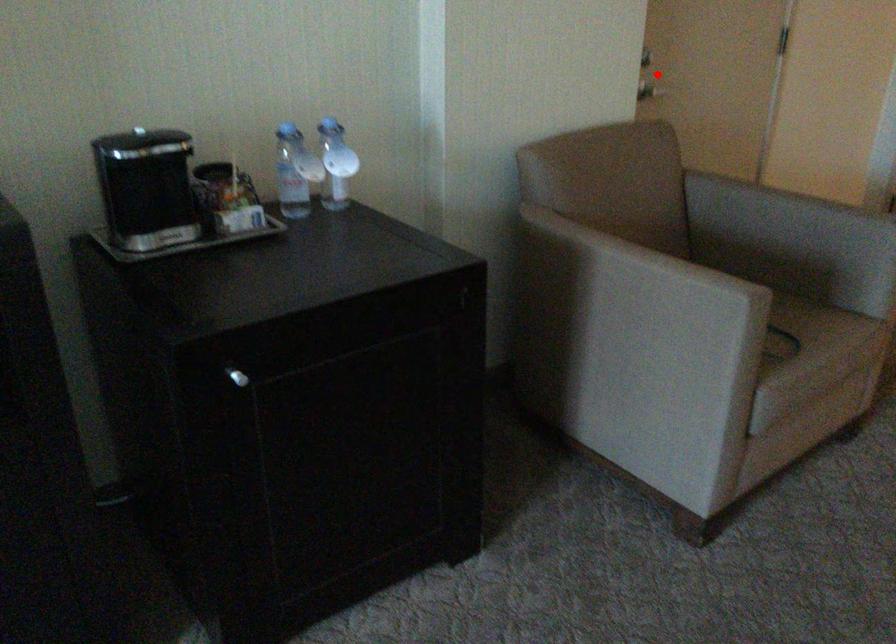
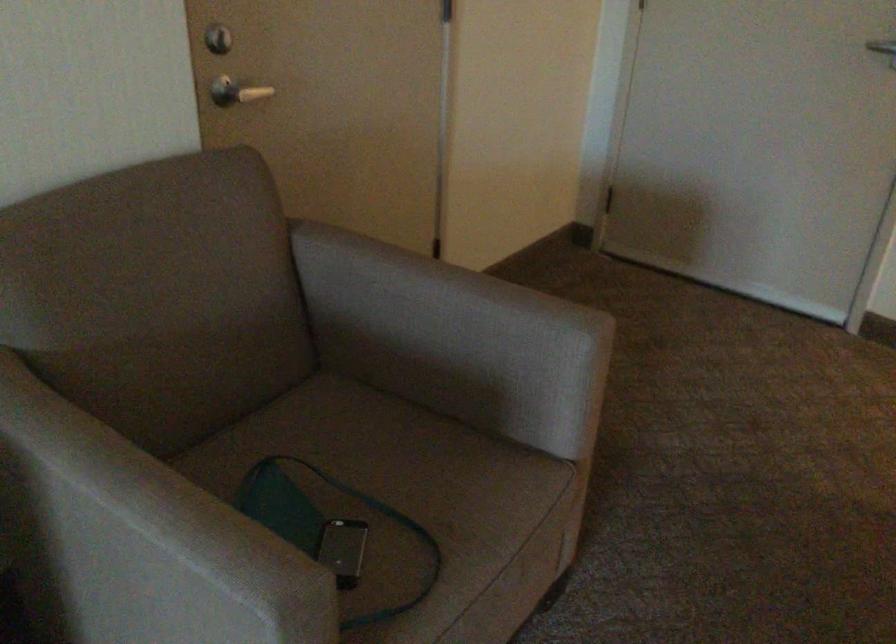
Question: I am providing you with two images of the same scene from different viewpoints. A red point is shown in image1. For the corresponding object point in image2, is it positioned nearer or farther from the camera?

Choices:
 (A) Nearer
 (B) Farther

Answer: (A)